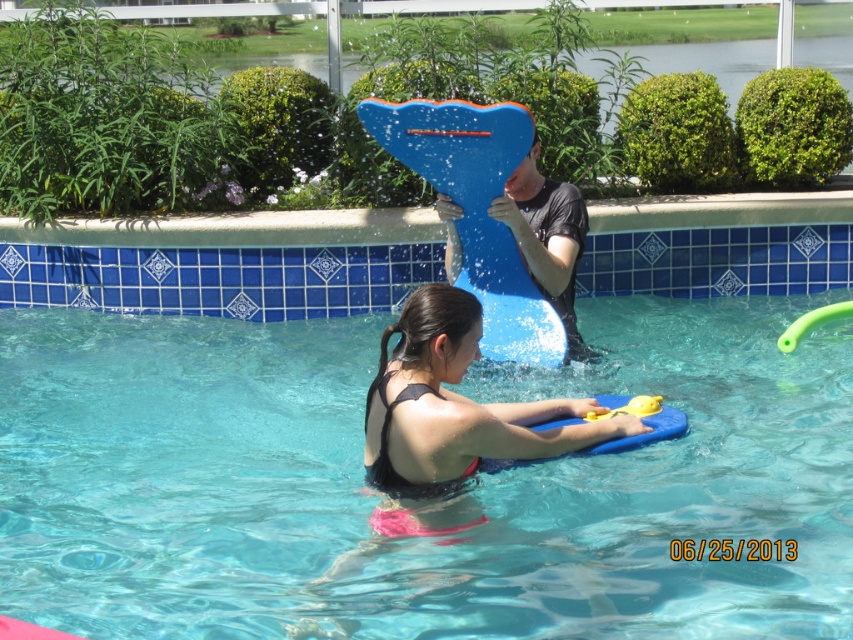
Which is more to the left, blue glossy pool at center or blue matte surfboard at center?

From the viewer's perspective, blue matte surfboard at center appears more on the left side.

From the picture: Is blue glossy pool at center closer to the viewer compared to blue matte surfboard at center?

That is True.

The height and width of the screenshot is (640, 853). Find the location of `blue glossy pool at center`. blue glossy pool at center is located at coordinates (189, 413).

Where is `blue glossy pool at center`? blue glossy pool at center is located at coordinates point(189,413).

In the scene shown: Can you confirm if blue glossy pool at center is thinner than matte black swimsuit at center?

No.

Looking at this image, who is more distant from viewer, (326, 534) or (467, 420)?

The point (326, 534) is more distant.

Does point (6, 276) lie in front of point (419, 448)?

No.

Locate an element on the screen. blue glossy pool at center is located at coordinates point(189,413).

Who is positioned more to the left, matte black swimsuit at center or blue matte surfboard at center?

matte black swimsuit at center

Describe the element at coordinates (456, 404) in the screenshot. The image size is (853, 640). I see `matte black swimsuit at center` at that location.

Find the location of a particular element. matte black swimsuit at center is located at coordinates [456, 404].